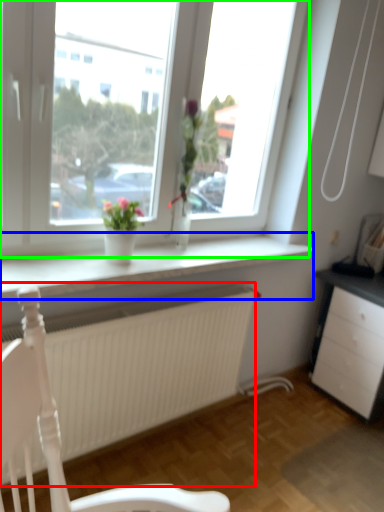
Question: Estimate the real-world distances between objects in this image. Which object is closer to carpets (highlighted by a red box), window sill (highlighted by a blue box) or window (highlighted by a green box)?

Choices:
 (A) window sill
 (B) window

Answer: (A)